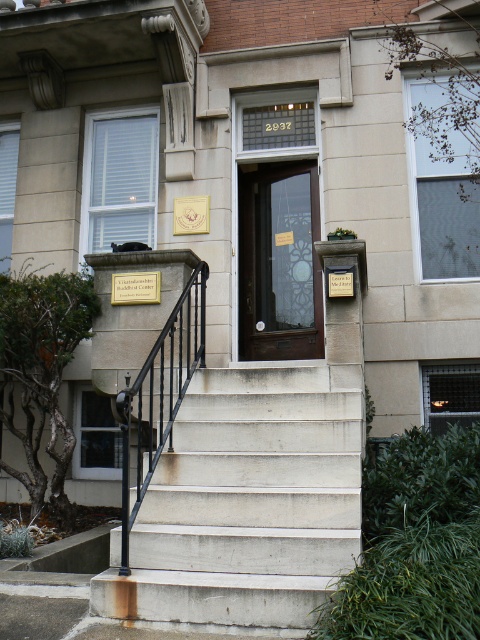
You are a visitor approaching the entrance of the Vikradamshtri Buddhist Center. You notice the black wrought iron railing at center and the gold metallic plaque at upper center. Which object is taller?

The black wrought iron railing at center is taller than the gold metallic plaque at upper center.